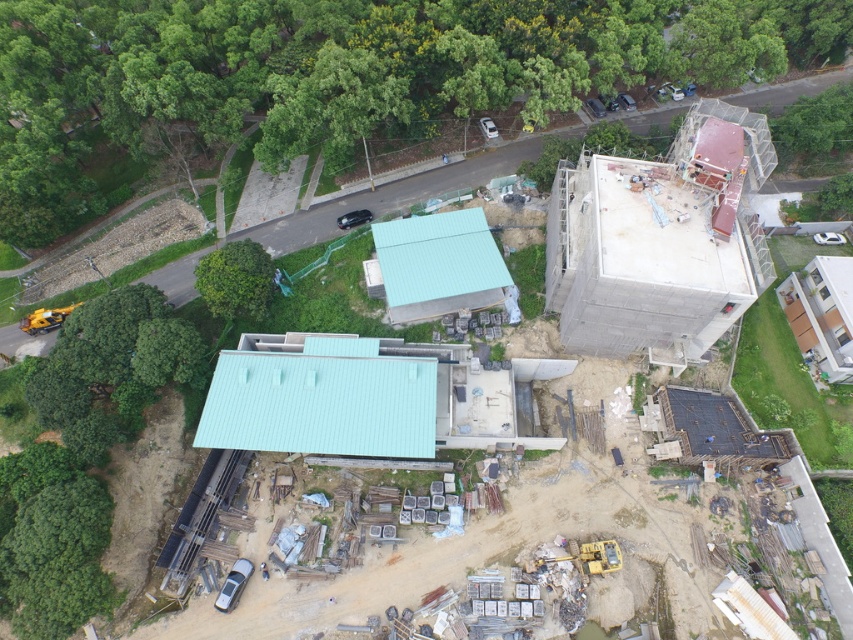
Is point (27, 244) closer to viewer compared to point (381, 61)?

No, (27, 244) is behind (381, 61).

The image size is (853, 640). Describe the element at coordinates (346, 72) in the screenshot. I see `green leafy tree at upper left` at that location.

Is point (621, 76) closer to camera compared to point (325, 68)?

No, it is not.

At what (x,y) coordinates should I click in order to perform the action: click on green leafy tree at upper left. Please return your answer as a coordinate pair (x, y). This screenshot has width=853, height=640. Looking at the image, I should click on (346, 72).

Between green leafy tree at upper center and green leafy tree at center, which one appears on the right side from the viewer's perspective?

Positioned to the right is green leafy tree at upper center.

Measure the distance from green leafy tree at upper center to green leafy tree at center.

green leafy tree at upper center and green leafy tree at center are 14.22 meters apart.

This screenshot has height=640, width=853. Describe the element at coordinates (329, 106) in the screenshot. I see `green leafy tree at upper center` at that location.

Identify the location of green leafy tree at upper center. (329, 106).

Between green leafy tree at upper left and green leafy tree at center, which one has more height?

green leafy tree at upper left is taller.

Is green leafy tree at upper left shorter than green leafy tree at center?

No.

Measure the distance between point (222, 76) and camera.

Point (222, 76) is 83.38 meters away from camera.

This screenshot has width=853, height=640. I want to click on green leafy tree at upper left, so click(x=346, y=72).